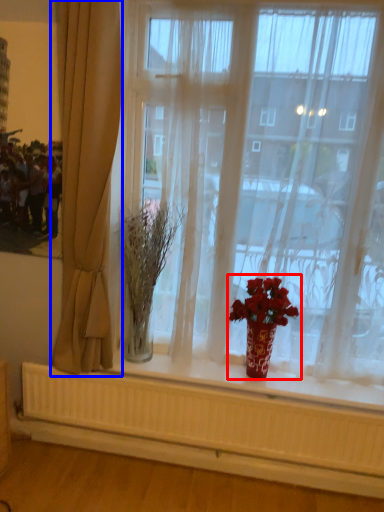
Question: Which of the following is the closest to the observer, houseplant (highlighted by a red box) or curtain (highlighted by a blue box)?

Choices:
 (A) houseplant
 (B) curtain

Answer: (B)